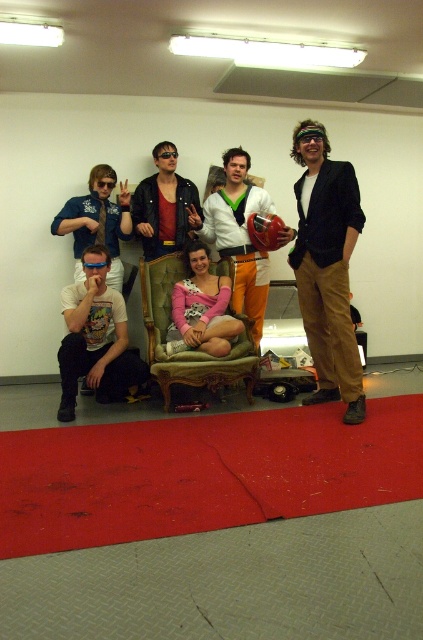
Who is more distant from viewer, (327,257) or (230,246)?

Positioned behind is point (230,246).

What do you see at coordinates (326, 268) in the screenshot? This screenshot has height=640, width=423. I see `matte black blazer at right` at bounding box center [326, 268].

Locate an element on the screen. The image size is (423, 640). matte black blazer at right is located at coordinates (326, 268).

Does matte black blazer at right have a lesser width compared to tufted fabric armchair at center?

Yes.

Who is more forward, (310, 196) or (228, 378)?

Positioned in front is point (310, 196).

This screenshot has height=640, width=423. In order to click on matte black blazer at right in this screenshot , I will do `click(326, 268)`.

Is matte black blazer at right thinner than black plastic goggles at upper center?

No.

Is matte black blazer at right positioned at the back of black plastic goggles at upper center?

No, matte black blazer at right is in front of black plastic goggles at upper center.

What do you see at coordinates (326, 268) in the screenshot?
I see `matte black blazer at right` at bounding box center [326, 268].

This screenshot has width=423, height=640. I want to click on matte black blazer at right, so click(326, 268).